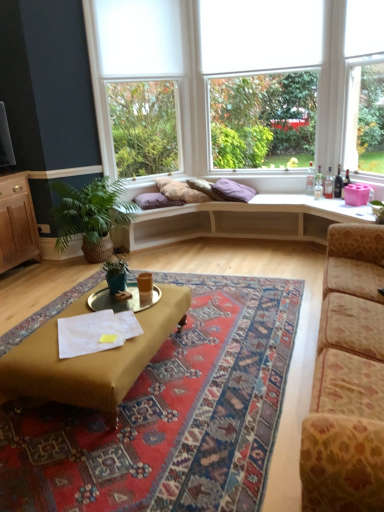
Question: Is mustard fabric coffee table at center positioned beyond the bounds of purple fabric pillow at center, marked as the second pillow in a right-to-left arrangement?

Choices:
 (A) yes
 (B) no

Answer: (A)

Question: Does mustard fabric coffee table at center have a lesser width compared to purple fabric pillow at center, marked as the second pillow in a right-to-left arrangement?

Choices:
 (A) no
 (B) yes

Answer: (A)

Question: Does mustard fabric coffee table at center turn towards purple fabric pillow at center, marked as the second pillow in a right-to-left arrangement?

Choices:
 (A) no
 (B) yes

Answer: (A)

Question: Considering the relative sizes of mustard fabric coffee table at center and purple fabric pillow at center, marked as the second pillow in a right-to-left arrangement, in the image provided, is mustard fabric coffee table at center shorter than purple fabric pillow at center, marked as the second pillow in a right-to-left arrangement,?

Choices:
 (A) yes
 (B) no

Answer: (B)

Question: Is mustard fabric coffee table at center to the left of purple fabric pillow at center, the 1th pillow in the left-to-right sequence, from the viewer's perspective?

Choices:
 (A) no
 (B) yes

Answer: (B)

Question: Considering the positions of mustard fabric coffee table at center and white fabric blind at upper center in the image, is mustard fabric coffee table at center taller or shorter than white fabric blind at upper center?

Choices:
 (A) short
 (B) tall

Answer: (A)

Question: Does point (13, 350) appear closer or farther from the camera than point (240, 70)?

Choices:
 (A) farther
 (B) closer

Answer: (B)

Question: From the image's perspective, relative to white fabric blind at upper center, is mustard fabric coffee table at center above or below?

Choices:
 (A) above
 (B) below

Answer: (B)

Question: From a real-world perspective, relative to white fabric blind at upper center, is mustard fabric coffee table at center vertically above or below?

Choices:
 (A) above
 (B) below

Answer: (B)

Question: From the image's perspective, is purple fabric pillow at center, the 1th pillow in the left-to-right sequence, located above or below mustard fabric coffee table at center?

Choices:
 (A) above
 (B) below

Answer: (A)

Question: Relative to mustard fabric coffee table at center, is purple fabric pillow at center, marked as the second pillow in a right-to-left arrangement, in front or behind?

Choices:
 (A) behind
 (B) front

Answer: (A)

Question: Is point (134, 197) closer or farther from the camera than point (170, 306)?

Choices:
 (A) farther
 (B) closer

Answer: (A)

Question: Is purple fabric pillow at center, marked as the second pillow in a right-to-left arrangement, taller or shorter than mustard fabric coffee table at center?

Choices:
 (A) short
 (B) tall

Answer: (A)

Question: From the image's perspective, is green leafy plant at left, which is counted as the 2th houseplant, starting from the front, located above or below leopard print fabric couch at right?

Choices:
 (A) above
 (B) below

Answer: (A)

Question: Relative to leopard print fabric couch at right, is green leafy plant at left, the first houseplant in the back-to-front sequence, in front or behind?

Choices:
 (A) front
 (B) behind

Answer: (B)